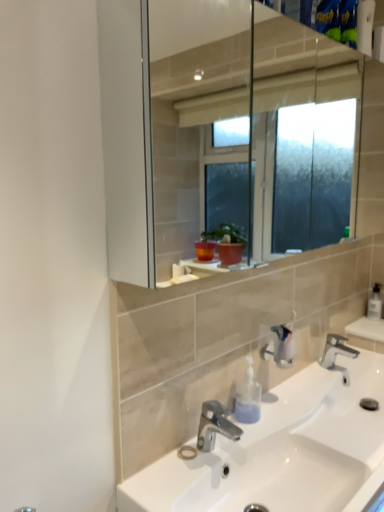
Question: From a real-world perspective, is clear plastic soap dispenser at right, which ranks as the first soap dispenser in right-to-left order, above or below white ceramic sink at center?

Choices:
 (A) above
 (B) below

Answer: (A)

Question: Does point (372, 312) appear closer or farther from the camera than point (327, 480)?

Choices:
 (A) closer
 (B) farther

Answer: (B)

Question: Estimate the real-world distances between objects in this image. Which object is farther from the polished chrome faucet at center, acting as the 2th tap starting from the back?

Choices:
 (A) polished chrome faucet at lower center, which is the first tap from back to front
 (B) translucent plastic soap dispenser at lower center, placed as the first soap dispenser when sorted from bottom to top
 (C) clear plastic soap dispenser at right, which is counted as the second soap dispenser, starting from the front
 (D) satin nickel faucet at center
 (E) white ceramic sink at center

Answer: (C)

Question: Estimate the real-world distances between objects in this image. Which object is closer to the clear plastic soap dispenser at right, which is counted as the second soap dispenser, starting from the front?

Choices:
 (A) polished chrome faucet at center, acting as the first tap starting from the left
 (B) translucent plastic soap dispenser at lower center, which ranks as the first soap dispenser in left-to-right order
 (C) satin nickel faucet at center
 (D) white ceramic sink at center
 (E) polished chrome faucet at lower center, which is the first tap from back to front

Answer: (E)